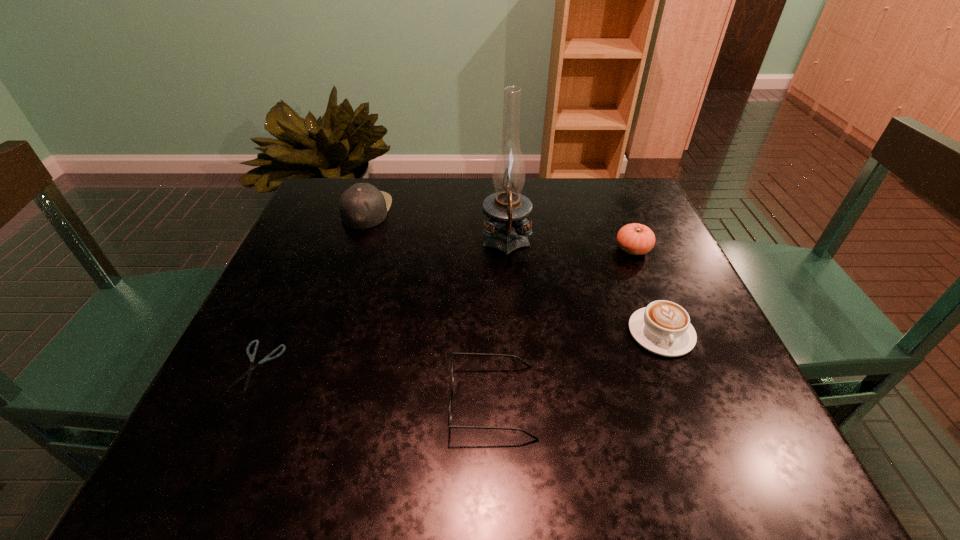
I want to click on shears situated at the left edge, so click(249, 372).

This screenshot has width=960, height=540. Identify the location of tomato present at the right edge. (636, 239).

Where is `cappuccino present at the right edge`? This screenshot has height=540, width=960. cappuccino present at the right edge is located at coordinates (663, 327).

Locate an element on the screen. The image size is (960, 540). object that is positioned at the far left corner is located at coordinates (362, 206).

This screenshot has height=540, width=960. I want to click on vacant space at the far edge, so click(x=430, y=209).

The height and width of the screenshot is (540, 960). What are the coordinates of `free point at the near edge` in the screenshot? It's located at (626, 467).

Identify the location of free spot at the left edge of the desktop. (339, 287).

Where is `vacant area at the right edge of the desktop`? vacant area at the right edge of the desktop is located at coordinates (695, 390).

This screenshot has height=540, width=960. I want to click on vacant space at the far left corner of the desktop, so click(309, 227).

You are a GUI agent. You are given a task and a screenshot of the screen. Output one action in this format:
    pyautogui.click(x=<x>, y=<y>)
    Task: Click on the free space at the near left corner of the desktop
    
    Given the screenshot: What is the action you would take?
    pyautogui.click(x=276, y=441)